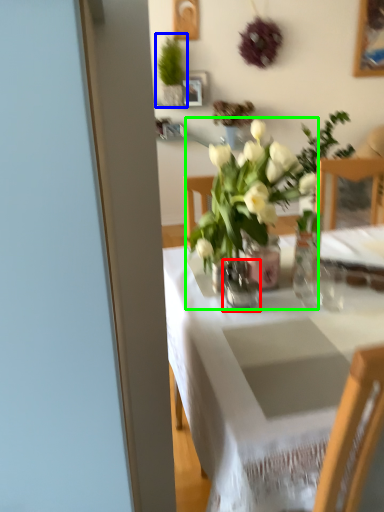
Question: Which object is the closest to the vase (highlighted by a red box)? Choose among these: houseplant (highlighted by a blue box) or houseplant (highlighted by a green box).

Choices:
 (A) houseplant
 (B) houseplant

Answer: (B)